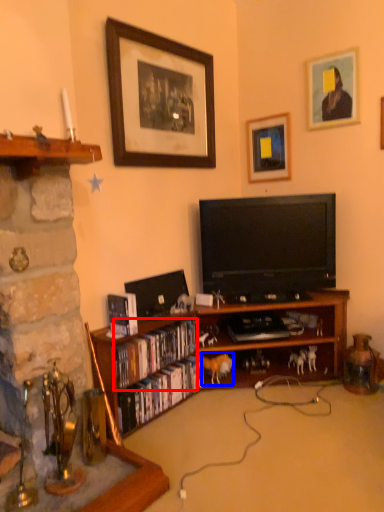
Question: Which point is closer to the camera, book (highlighted by a red box) or animal (highlighted by a blue box)?

Choices:
 (A) book
 (B) animal

Answer: (A)